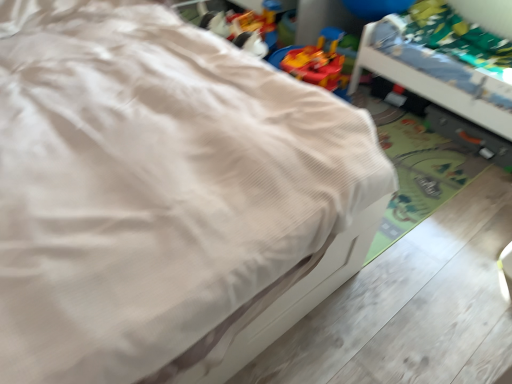
The image size is (512, 384). Describe the element at coordinates (448, 68) in the screenshot. I see `white plastic hospital bed at upper right` at that location.

Locate an element on the screen. white plastic hospital bed at upper right is located at coordinates (448, 68).

Measure the distance between white plastic hospital bed at upper right and camera.

white plastic hospital bed at upper right is 7.11 feet from camera.

I want to click on white plastic hospital bed at upper right, so click(x=448, y=68).